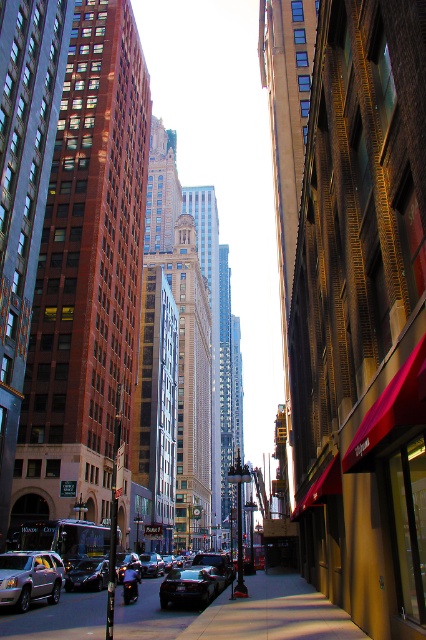
Question: Does shiny black car at center have a smaller size compared to shiny black sedan at center?

Choices:
 (A) yes
 (B) no

Answer: (B)

Question: Among these objects, which one is farthest from the camera?

Choices:
 (A) concrete sidewalk at lower center
 (B) silver metallic taxi at lower left
 (C) shiny black car at center

Answer: (C)

Question: Is metallic silver sedan at lower left bigger than shiny black sedan at center?

Choices:
 (A) yes
 (B) no

Answer: (A)

Question: Considering the relative positions of silver metallic taxi at lower left and shiny black sedan at center in the image provided, where is silver metallic taxi at lower left located with respect to shiny black sedan at center?

Choices:
 (A) above
 (B) below

Answer: (A)

Question: Among these objects, which one is farthest from the camera?

Choices:
 (A) concrete sidewalk at lower center
 (B) shiny black car at center
 (C) silver metallic taxi at lower left
 (D) shiny black sedan at center

Answer: (D)

Question: Which point is closer to the camera taking this photo?

Choices:
 (A) (20, 593)
 (B) (190, 586)

Answer: (A)